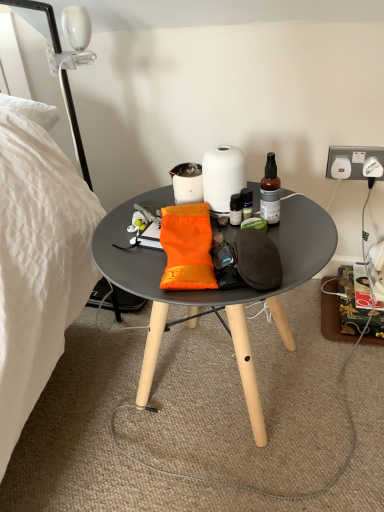
The width and height of the screenshot is (384, 512). In order to click on vacant area situated to the left side of matte white coffee cup at center in this screenshot , I will do `click(141, 204)`.